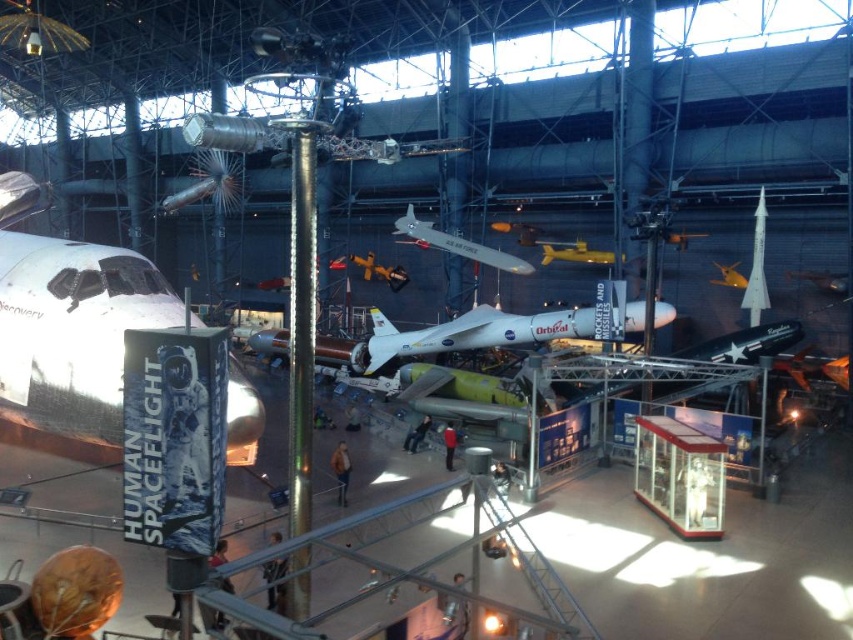
You are an astronaut preparing for a spacewalk simulation in the museum. You need to move from the starting point at point (445, 232) to the exit point at point (741, 285). Will you be moving towards or away from the large white aircraft on the left side of the frame during this movement?

Since point (445, 232) is behind point (741, 285), moving from the starting point to the exit point means you are moving forward towards the large white aircraft on the left side of the frame.

You are a visitor standing at the entrance of the museum. You want to take a photo of the shiny metallic airplane at center from where you are standing. Is the distance between you and the airplane sufficient to capture the entire airplane in your camera frame?

The distance between the shiny metallic airplane at center and the camera is 21.34 meters, so yes, the distance is sufficient to capture the entire airplane in your camera frame.

You are a visitor standing in the middle of the museum. You want to take a photo of both the white glossy airplane at left and the metallic yellow airplane at center without any obstruction. Which airplane should you position yourself closer to, and why?

You should position yourself closer to the metallic yellow airplane at center. Since the white glossy airplane at left is much taller than the metallic yellow airplane at center, standing closer to the shorter metallic yellow airplane at center will help ensure both airplanes are visible in the frame without the taller one blocking the view.